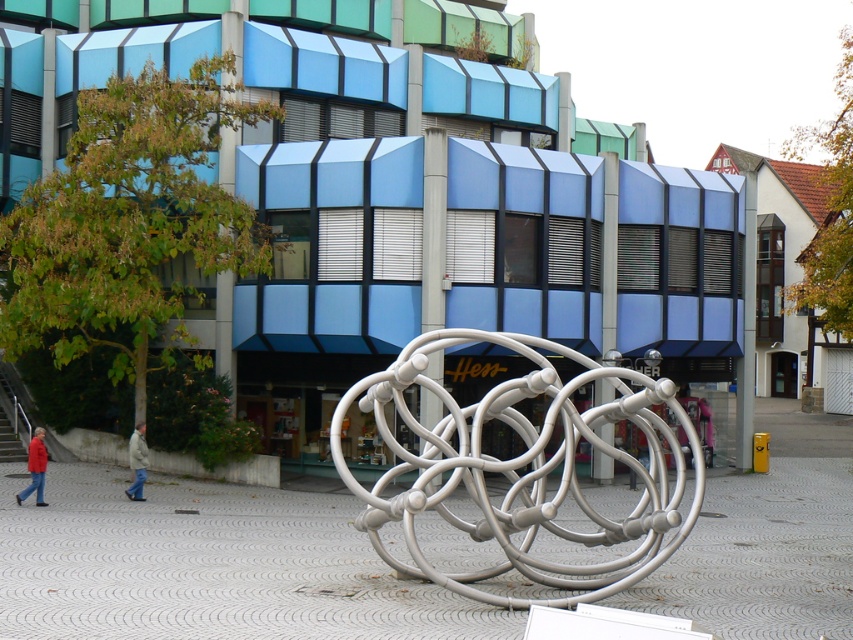
Based on the photo, you are standing in front of the modern urban setting described. You want to take a photo that includes both the white metallic sculpture at center and the building with blue and green awnings. Given that your camera has a maximum zoom range of 100 feet, can you capture both subjects in a single frame without moving your position?

The distance between the white metallic sculpture at center and the viewer is 48.51 feet, which is within the camera maximum zoom range of 100 feet. Therefore, you can capture both subjects in a single frame without moving your position.